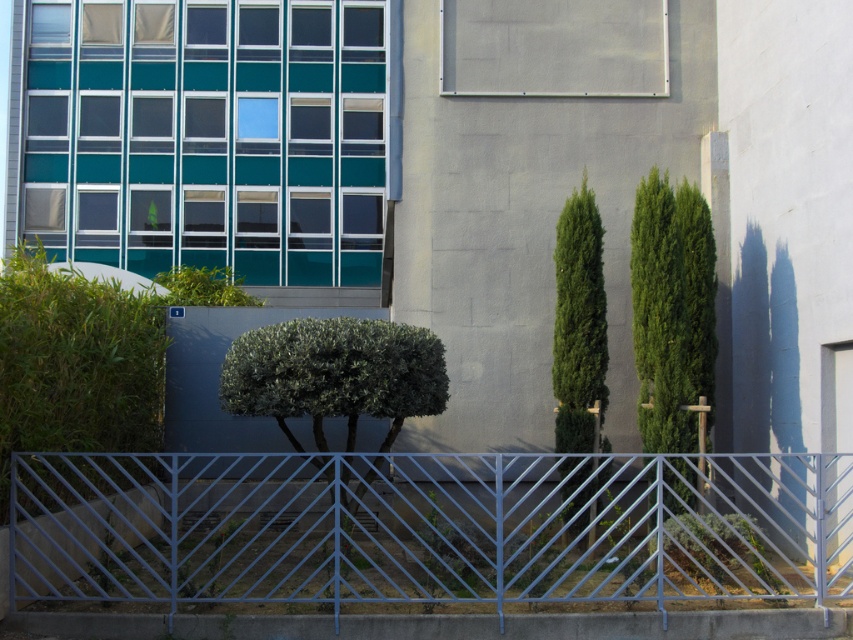
You are a delivery person trying to determine if the green leafy tree at right is visible from the street. Since the metallic blue fence at center is in front of it, can you see the tree through the fence?

The green leafy tree at right is behind the metallic blue fence at center, so it is partially or fully obscured by the fence and may not be fully visible from the street.

You are a gardener planning to water the plants in the scene. You notice the metallic blue fence at center and the green leafy bush at center. Which object is located lower in the image?

The metallic blue fence at center is below green leafy bush at center, so the metallic blue fence at center is located lower in the image.